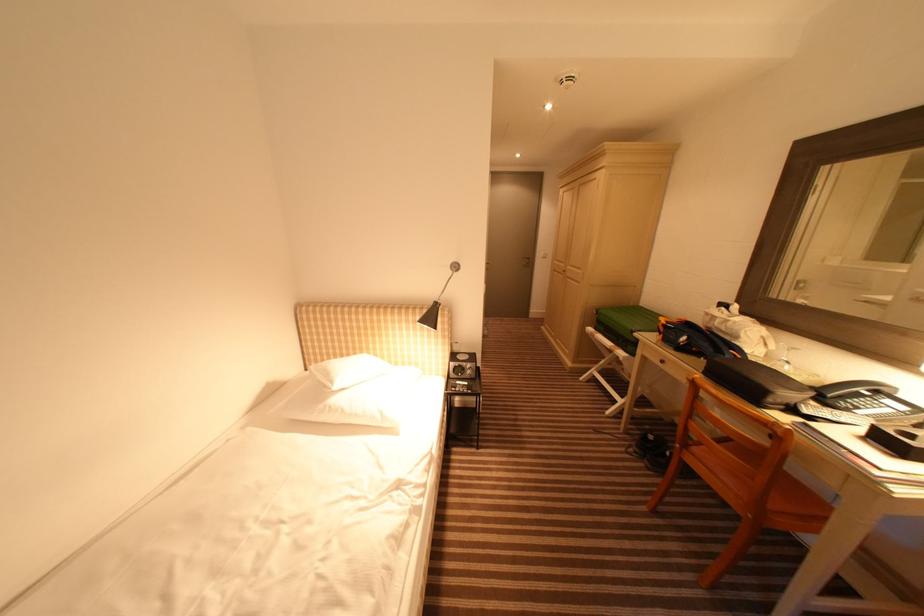
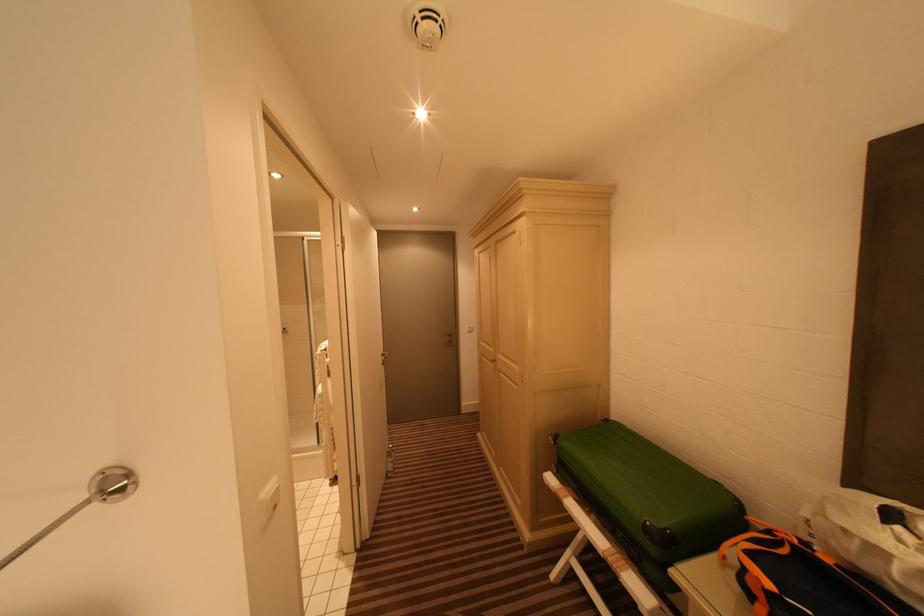
The point at (565, 274) is marked in the first image. Where is the corresponding point in the second image?

(494, 362)